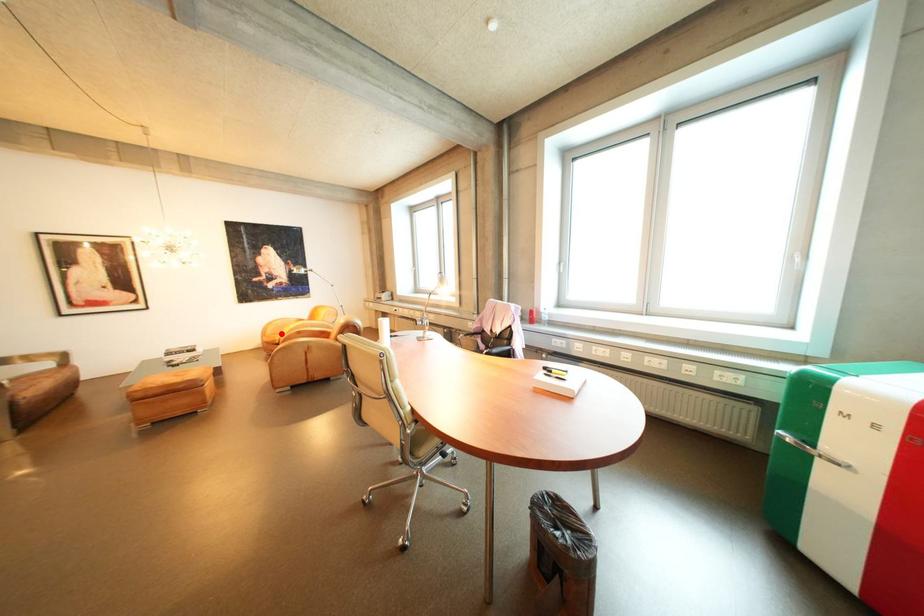
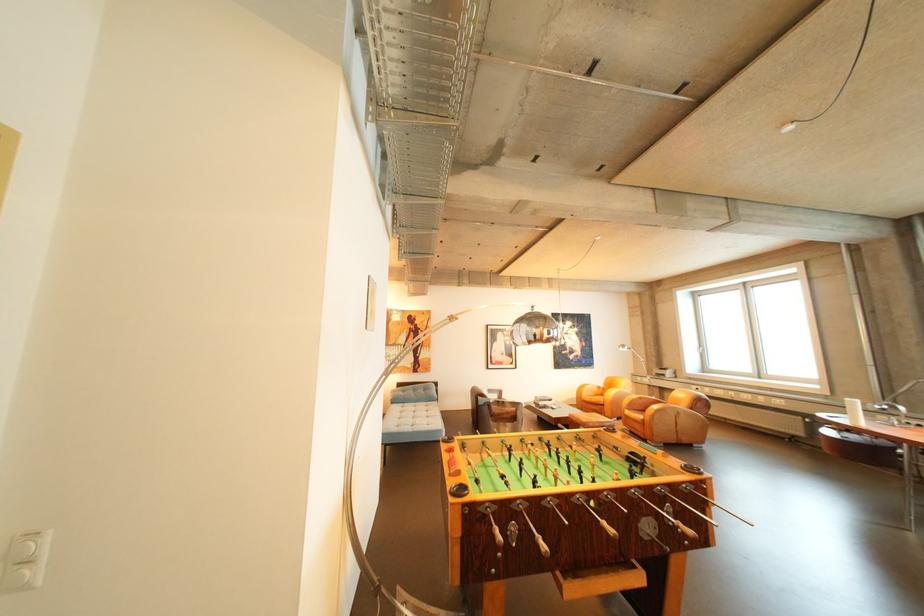
Question: A red point is marked in image1. In image2, is the corresponding 3D point closer to the camera or farther? Reply with the corresponding letter.

Choices:
 (A) The corresponding 3D point is closer.
 (B) The corresponding 3D point is farther.

Answer: (A)